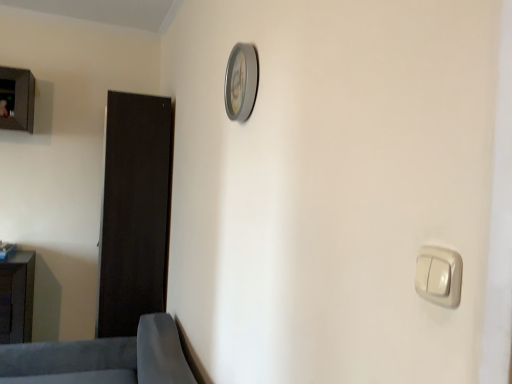
Question: Considering the positions of point (433, 286) and point (246, 114), is point (433, 286) closer or farther from the camera than point (246, 114)?

Choices:
 (A) closer
 (B) farther

Answer: (A)

Question: From the image's perspective, relative to silver metallic clock at upper center, is white glossy light switch at lower right above or below?

Choices:
 (A) above
 (B) below

Answer: (B)

Question: Considering the real-world distances, which object is farthest from the matte black cabinet at lower left, the second furniture when ordered from right to left?

Choices:
 (A) dark wood door at left
 (B) white glossy light switch at lower right
 (C) soft gray fabric sofa at lower left, arranged as the second furniture when viewed from the left
 (D) silver metallic clock at upper center

Answer: (B)

Question: Estimate the real-world distances between objects in this image. Which object is closer to the silver metallic clock at upper center?

Choices:
 (A) white glossy light switch at lower right
 (B) soft gray fabric sofa at lower left, which appears as the 2th furniture when viewed from the back
 (C) dark wood door at left
 (D) matte black cabinet at lower left, placed as the first furniture when sorted from left to right

Answer: (A)